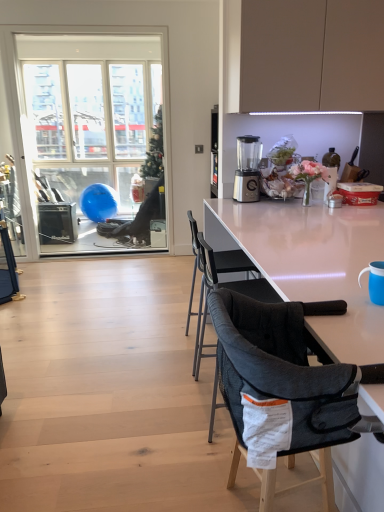
In order to click on free space to the back side of blue plastic cup at right in this screenshot , I will do `click(345, 279)`.